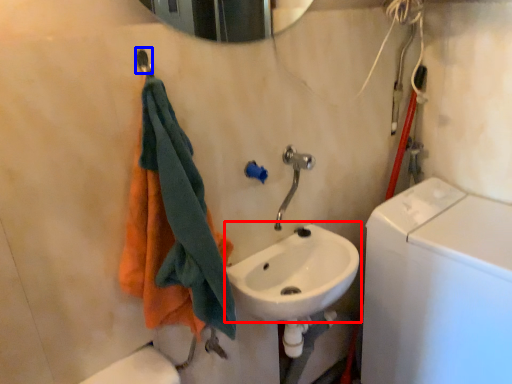
Question: Among these objects, which one is nearest to the camera, sink (highlighted by a red box) or shower (highlighted by a blue box)?

Choices:
 (A) sink
 (B) shower

Answer: (B)